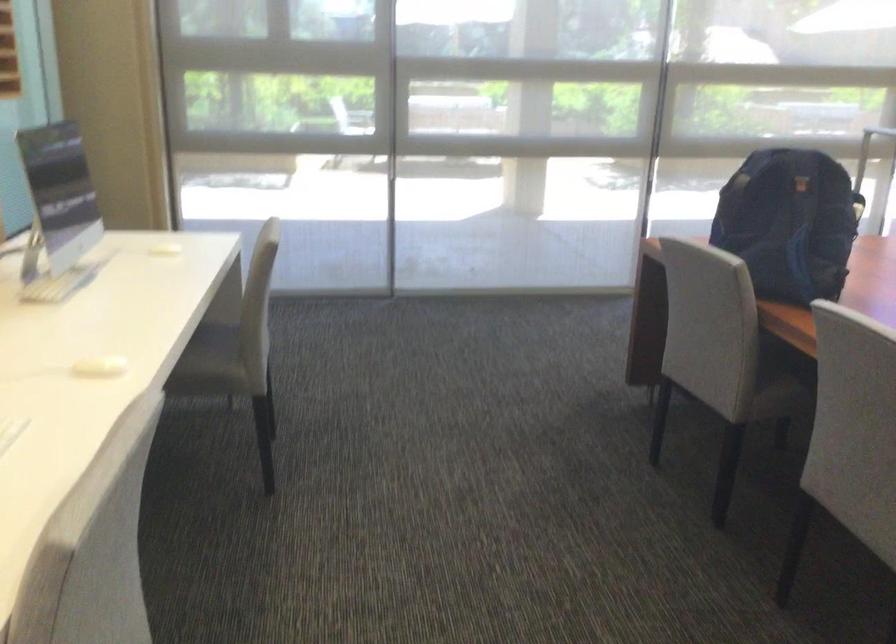
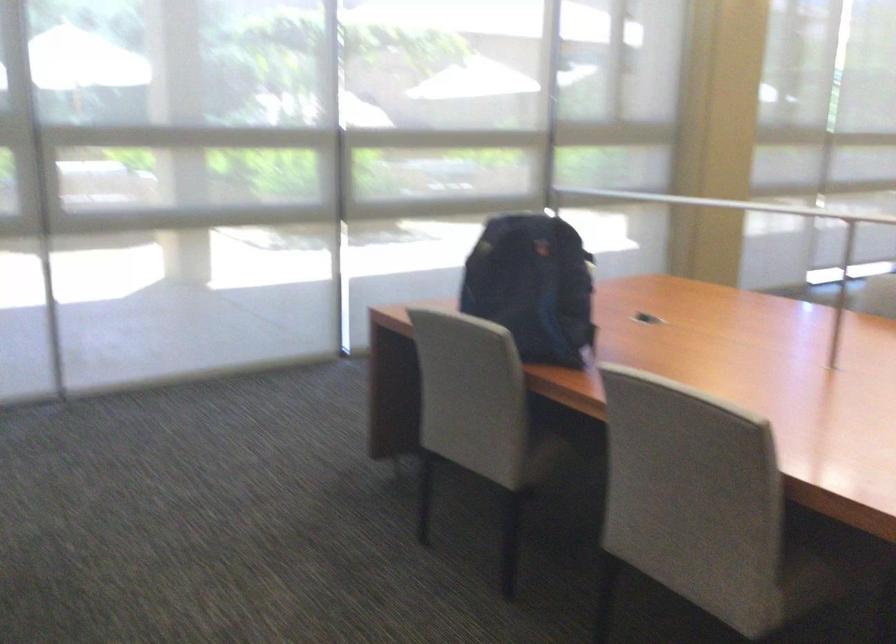
Question: The images are taken continuously from a first-person perspective. In which direction is your viewpoint rotating?

Choices:
 (A) Left
 (B) Right
 (C) Up
 (D) Down

Answer: (B)